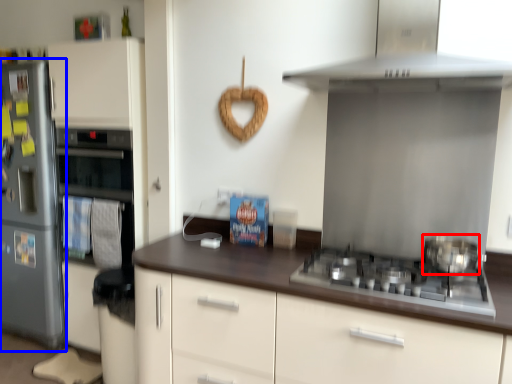
Question: Which point is further to the camera, kitchen appliance (highlighted by a red box) or refrigerator (highlighted by a blue box)?

Choices:
 (A) kitchen appliance
 (B) refrigerator

Answer: (B)